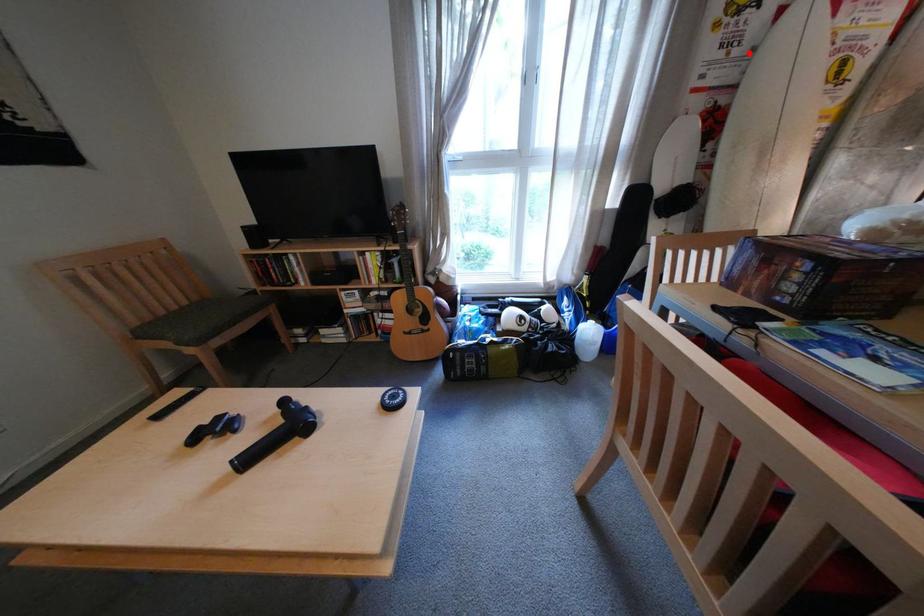
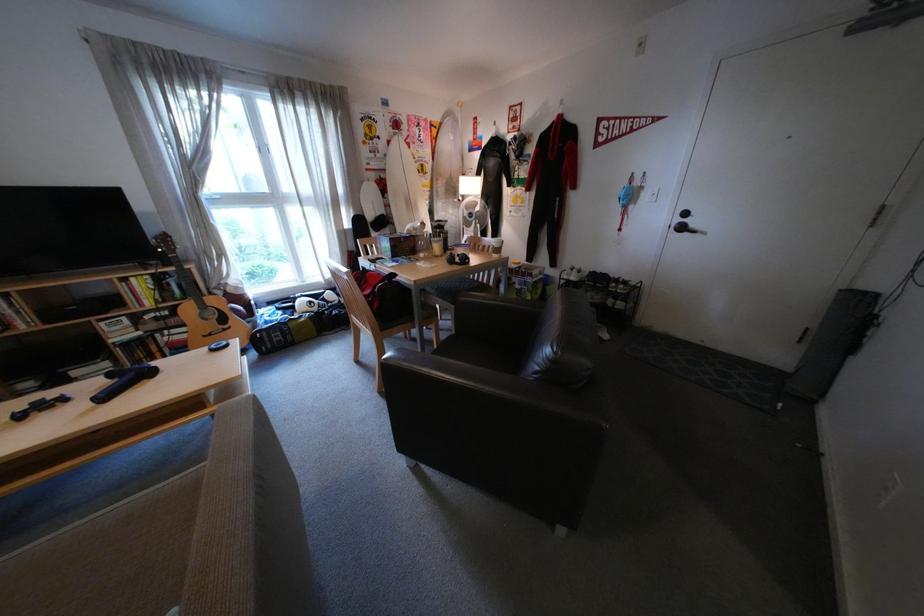
Find the pixel in the second image that matches the highlighted location in the first image.

(392, 156)